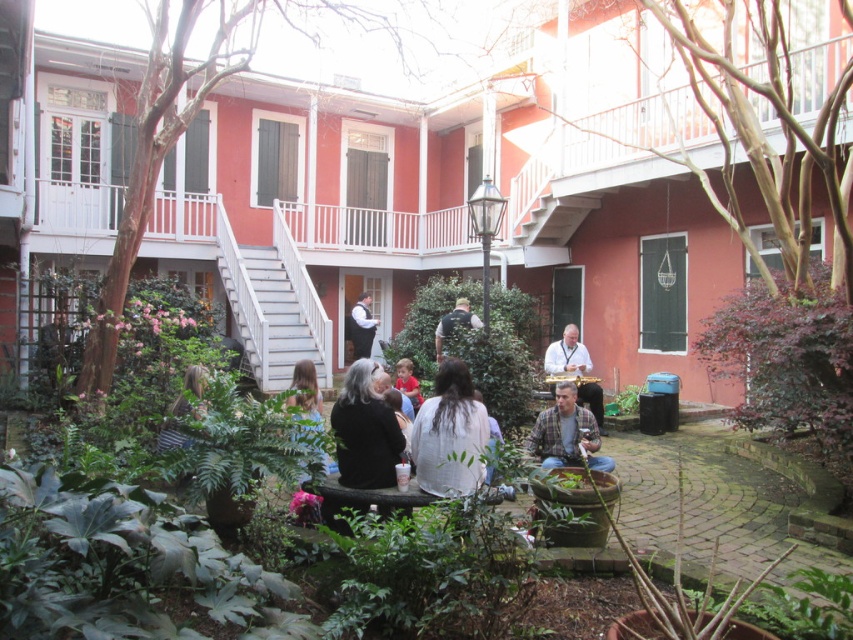
Does light brown hair at lower center appear on the right side of red shirt at center?

In fact, light brown hair at lower center is to the left of red shirt at center.

I want to click on light brown hair at lower center, so click(x=305, y=387).

Can you confirm if white matte shirt at center is taller than green leafy plant at center?

Yes, white matte shirt at center is taller than green leafy plant at center.

Which is behind, point (445, 467) or point (637, 404)?

Positioned behind is point (637, 404).

Which is in front, point (457, 387) or point (624, 387)?

Point (457, 387) is more forward.

What are the coordinates of `white matte shirt at center` in the screenshot? It's located at (450, 435).

Who is shorter, black matte jacket at center or red shirt at center?

Standing shorter between the two is red shirt at center.

Who is more forward, (357, 436) or (409, 396)?

Positioned in front is point (357, 436).

Which is in front, point (393, 481) or point (395, 387)?

Point (393, 481)

Identify the location of black matte jacket at center. The width and height of the screenshot is (853, 640). (364, 432).